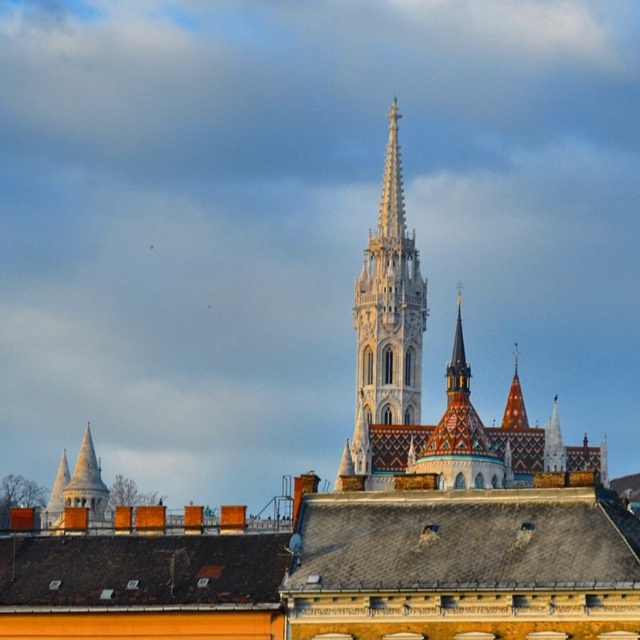
Consider the image. You are a tour guide leading a group through the historic city. You want to ensure everyone can see both the white stone spire at center and the white stone tower at lower left from their current position. Given that the minimum distance required for comfortable viewing is 30 meters, can the group view both landmarks comfortably from here?

The distance between the white stone spire at center and the white stone tower at lower left is 31.71 meters, which exceeds the minimum required distance of 30 meters. Therefore, the group can comfortably view both landmarks from their current position.

You are an architect analyzing the cityscape. You need to determine which structure has a wider base. Based on the image, which one is wider between the white stone spire at center and the white stone tower at lower left?

The white stone tower at lower left is wider than the white stone spire at center.

You are a drone operator tasked with capturing aerial footage of the city. Your drone has a maximum flight range of 150 meters. If you are positioned at the white stone spire at center, can you fly your drone to the red and white tiled roof building on the right without exceeding the flight range?

The distance between the white stone spire at center and the red and white tiled roof building on the right is 148.77 meters, which is within the drone operator s 150 meter range. Yes, the drone can fly to the red and white tiled roof building on the right without exceeding its maximum range.